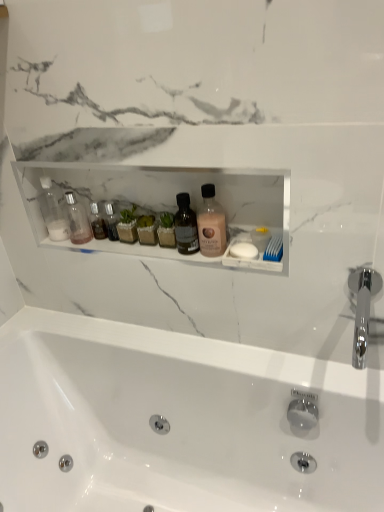
Question: Can you see clear glass bottle at left, arranged as the 1th toiletry when viewed from the right, touching white matte soap at right?

Choices:
 (A) no
 (B) yes

Answer: (A)

Question: Can you confirm if clear glass bottle at left, arranged as the 1th toiletry when viewed from the right, is thinner than white matte soap at right?

Choices:
 (A) yes
 (B) no

Answer: (B)

Question: Does clear glass bottle at left, arranged as the 1th toiletry when viewed from the right, come behind white matte soap at right?

Choices:
 (A) no
 (B) yes

Answer: (B)

Question: Can you confirm if clear glass bottle at left, arranged as the 1th toiletry when viewed from the right, is taller than white matte soap at right?

Choices:
 (A) no
 (B) yes

Answer: (B)

Question: Is clear glass bottle at left, arranged as the 1th toiletry when viewed from the right, wider than white matte soap at right?

Choices:
 (A) no
 (B) yes

Answer: (B)

Question: Is clear glass bottle at left, arranged as the 1th toiletry when viewed from the right, located outside white matte soap at right?

Choices:
 (A) no
 (B) yes

Answer: (B)

Question: From the image's perspective, would you say clear glass bottle at left, arranged as the 1th toiletry when viewed from the right, is shown under pink matte lotion at center?

Choices:
 (A) no
 (B) yes

Answer: (A)

Question: Is clear glass bottle at left, arranged as the 1th toiletry when viewed from the right, positioned behind pink matte lotion at center?

Choices:
 (A) no
 (B) yes

Answer: (B)

Question: Considering the relative sizes of clear glass bottle at left, arranged as the 1th toiletry when viewed from the right, and pink matte lotion at center in the image provided, is clear glass bottle at left, arranged as the 1th toiletry when viewed from the right, taller than pink matte lotion at center?

Choices:
 (A) no
 (B) yes

Answer: (A)

Question: From a real-world perspective, is clear glass bottle at left, arranged as the 1th toiletry when viewed from the right, located higher than pink matte lotion at center?

Choices:
 (A) yes
 (B) no

Answer: (B)

Question: From a real-world perspective, is clear glass bottle at left, the 2th toiletry when ordered from left to right, below pink matte lotion at center?

Choices:
 (A) yes
 (B) no

Answer: (A)

Question: From the image's perspective, is clear glass bottle at left, the 2th toiletry when ordered from left to right, located above pink matte lotion at center?

Choices:
 (A) no
 (B) yes

Answer: (B)

Question: Is chrome metallic faucet at right surrounded by clear glass bottle at left, the 2th toiletry when ordered from left to right?

Choices:
 (A) no
 (B) yes

Answer: (A)